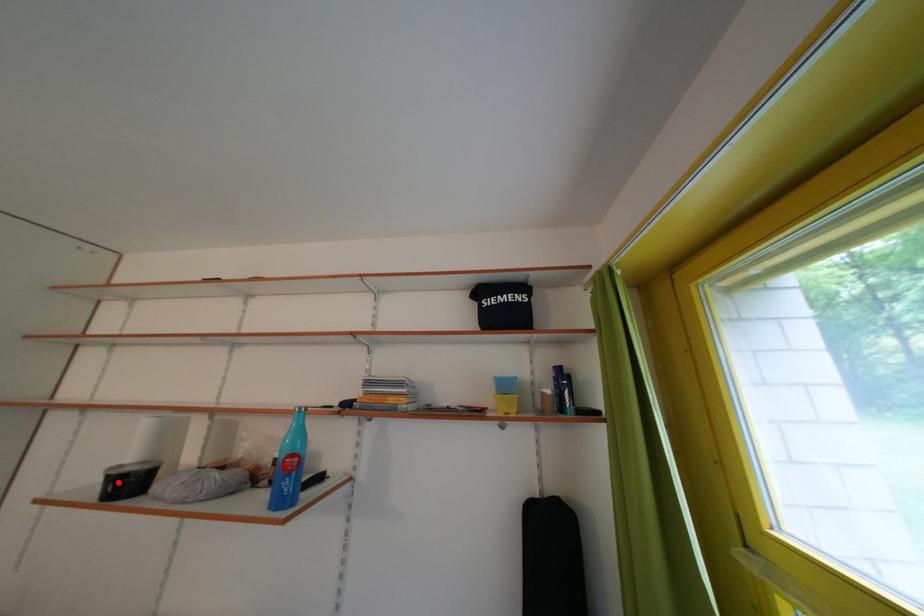
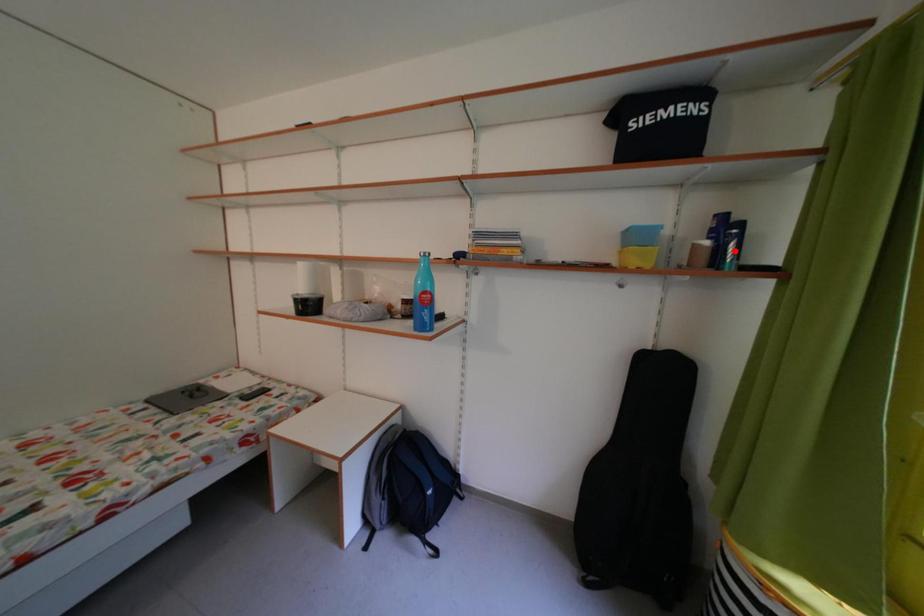
I am providing you with two images of the same scene from different viewpoints. A red point is marked on the first image and another point is marked on the second image. Does the point marked in image1 correspond to the same location as the one in image2?

No